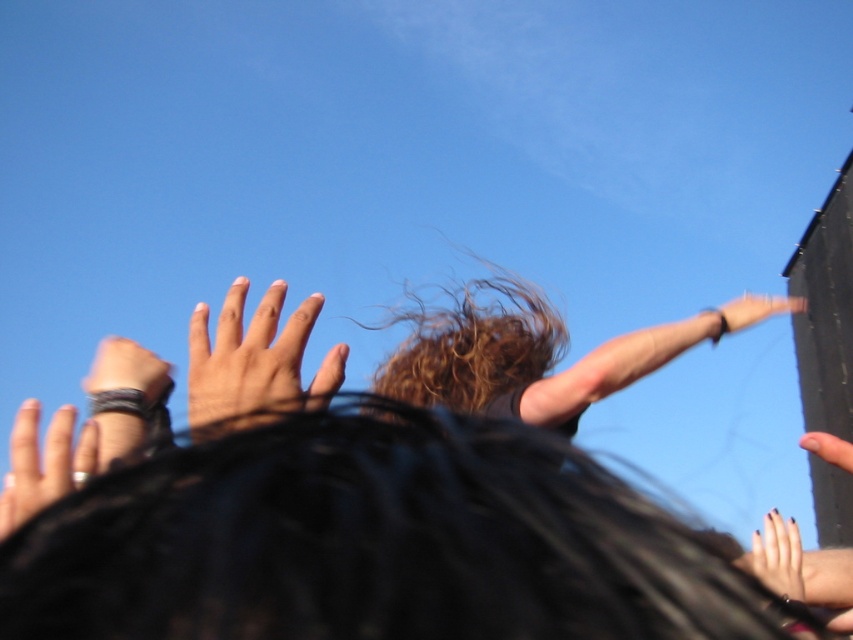
Question: Where is smooth skin hand at left located in relation to smooth skin hand at upper right in the image?

Choices:
 (A) right
 (B) left

Answer: (B)

Question: Which point appears closest to the camera in this image?

Choices:
 (A) (758, 541)
 (B) (827, 436)

Answer: (B)

Question: Does black matte hand at upper center appear under smooth skin hand at upper right?

Choices:
 (A) no
 (B) yes

Answer: (B)

Question: Among these points, which one is nearest to the camera?

Choices:
 (A) (4, 611)
 (B) (776, 296)
 (C) (844, 452)
 (D) (4, 509)

Answer: (A)

Question: Which of the following is the farthest from the observer?

Choices:
 (A) (616, 364)
 (B) (148, 424)
 (C) (265, 404)

Answer: (A)

Question: Can you confirm if dark brown hair at upper right is thinner than smooth skin hand at left?

Choices:
 (A) yes
 (B) no

Answer: (B)